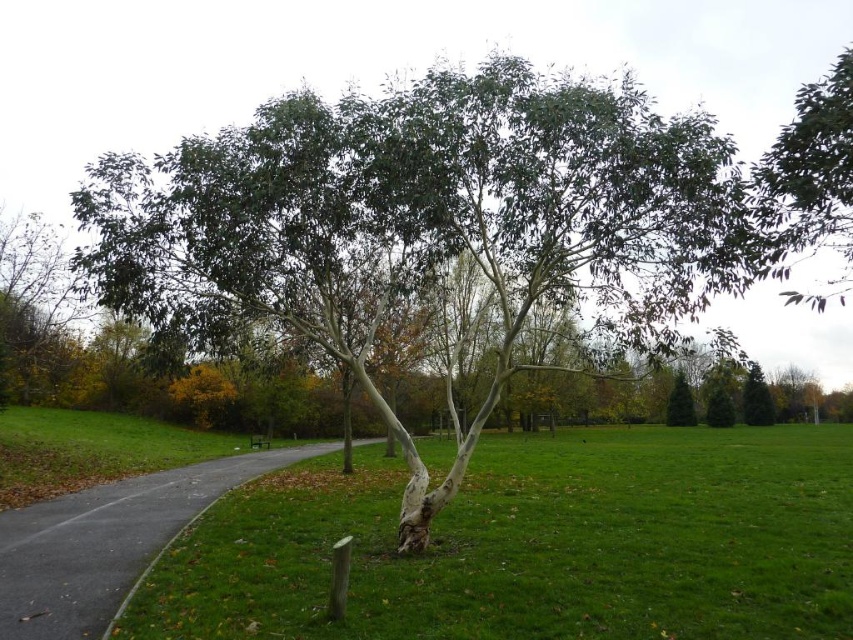
Can you confirm if green matte tree at center is bigger than green grassy at center?

Yes, green matte tree at center is bigger than green grassy at center.

Is green matte tree at center behind green grassy at center?

That is True.

Between point (537, 116) and point (627, 618), which one is positioned in front?

Point (627, 618) is in front.

Image resolution: width=853 pixels, height=640 pixels. In order to click on green matte tree at center in this screenshot , I will do `click(428, 220)`.

Between gray asphalt path at center and green matte tree at upper right, which one is positioned lower?

gray asphalt path at center is lower down.

Is gray asphalt path at center closer to the viewer compared to green matte tree at upper right?

No, it is behind green matte tree at upper right.

Where is `gray asphalt path at center`? gray asphalt path at center is located at coordinates (107, 541).

You are a GUI agent. You are given a task and a screenshot of the screen. Output one action in this format:
    pyautogui.click(x=<x>, y=<y>)
    Task: Click on the gray asphalt path at center
    
    Given the screenshot: What is the action you would take?
    pyautogui.click(x=107, y=541)

Does point (352, 522) lie behind point (264, 468)?

No, it is in front of (264, 468).

Which is below, green grassy at center or gray asphalt path at center?

green grassy at center

At what (x,y) coordinates should I click in order to perform the action: click on green grassy at center. Please return your answer as a coordinate pair (x, y). This screenshot has height=640, width=853. Looking at the image, I should click on (534, 545).

I want to click on green grassy at center, so click(534, 545).